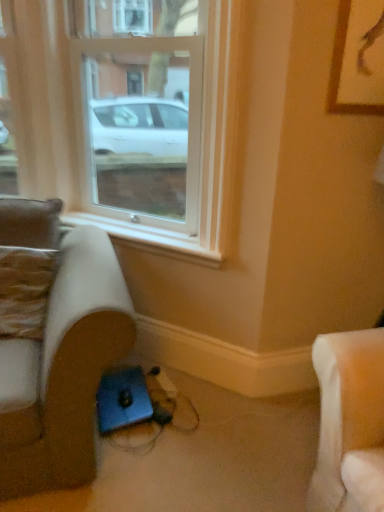
Question: Is clear glass window at center oriented towards suede-like beige studio couch at lower left?

Choices:
 (A) no
 (B) yes

Answer: (A)

Question: Considering the relative sizes of clear glass window at center and suede-like beige studio couch at lower left in the image provided, is clear glass window at center smaller than suede-like beige studio couch at lower left?

Choices:
 (A) yes
 (B) no

Answer: (A)

Question: Is clear glass window at center located outside suede-like beige studio couch at lower left?

Choices:
 (A) yes
 (B) no

Answer: (A)

Question: From a real-world perspective, is clear glass window at center physically above suede-like beige studio couch at lower left?

Choices:
 (A) no
 (B) yes

Answer: (B)

Question: From the image's perspective, would you say clear glass window at center is shown under suede-like beige studio couch at lower left?

Choices:
 (A) yes
 (B) no

Answer: (B)

Question: From a real-world perspective, is wooden framed picture at upper right physically located above or below leather-like brown pillow at left?

Choices:
 (A) above
 (B) below

Answer: (A)

Question: In terms of size, does wooden framed picture at upper right appear bigger or smaller than leather-like brown pillow at left?

Choices:
 (A) small
 (B) big

Answer: (A)

Question: From the image's perspective, is wooden framed picture at upper right positioned above or below leather-like brown pillow at left?

Choices:
 (A) above
 (B) below

Answer: (A)

Question: Is point (344, 108) closer or farther from the camera than point (34, 282)?

Choices:
 (A) closer
 (B) farther

Answer: (A)

Question: From a real-world perspective, relative to suede-like beige studio couch at lower left, is leather-like brown pillow at left vertically above or below?

Choices:
 (A) above
 (B) below

Answer: (A)

Question: Would you say leather-like brown pillow at left is to the left or to the right of suede-like beige studio couch at lower left in the picture?

Choices:
 (A) right
 (B) left

Answer: (B)

Question: From their relative heights in the image, would you say leather-like brown pillow at left is taller or shorter than suede-like beige studio couch at lower left?

Choices:
 (A) short
 (B) tall

Answer: (A)

Question: Which is correct: leather-like brown pillow at left is inside suede-like beige studio couch at lower left, or outside of it?

Choices:
 (A) inside
 (B) outside

Answer: (A)

Question: In the image, is clear glass window at center positioned in front of or behind white plastic window sill at lower center?

Choices:
 (A) behind
 (B) front

Answer: (B)

Question: Is clear glass window at center taller or shorter than white plastic window sill at lower center?

Choices:
 (A) short
 (B) tall

Answer: (B)